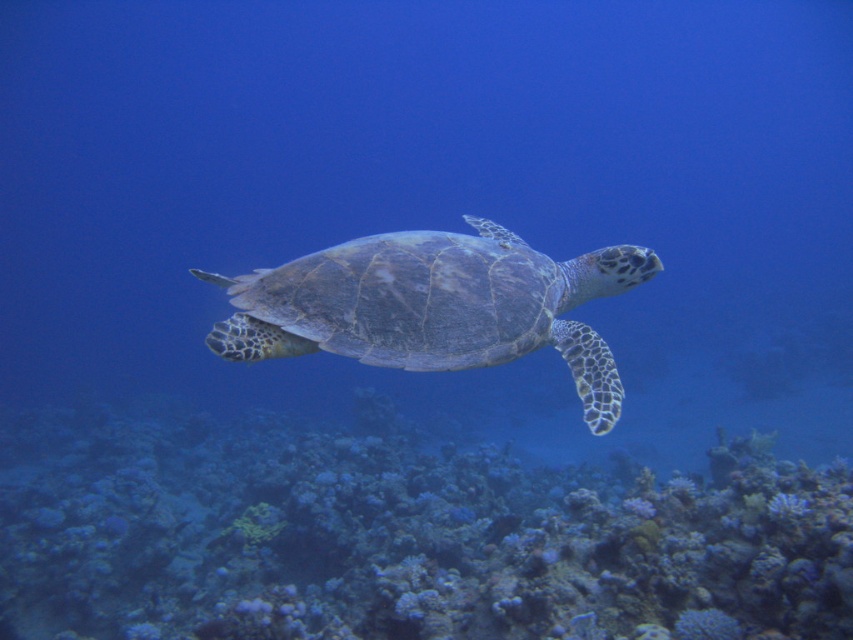
You are a marine biologist studying underwater ecosystems. You observe the rusty coral reef at center in the image. Can you determine its exact position using the coordinate system provided?

The rusty coral reef at center is located at point (399, 536) in the coordinate system provided.

You are a marine biologist using a camera to document sea turtles. Your camera has a depth of field that can focus clearly on objects within 10 feet. You notice the point at coordinates point (x=850, y=500) in your viewfinder. Can you confirm if this point is within your camera focus range?

The point (x=850, y=500) is 10.81 feet from the camera, which is slightly beyond the 10 feet focus range. Therefore, the point may not be in focus.